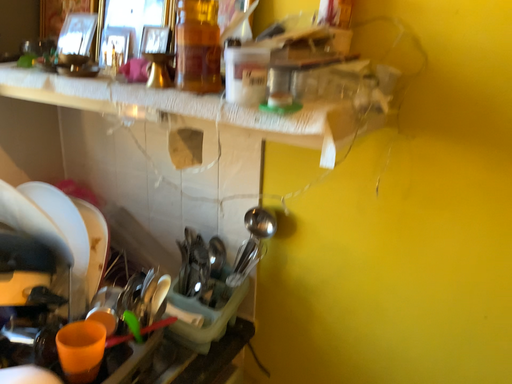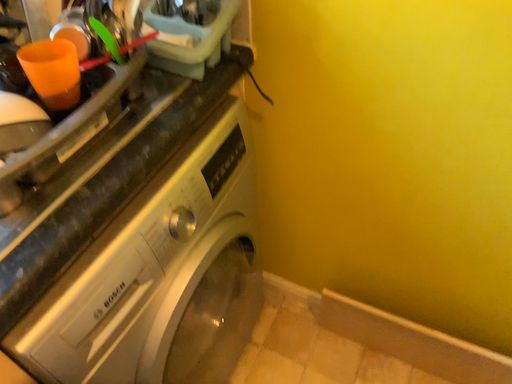
Question: How did the camera likely rotate when shooting the video?

Choices:
 (A) rotated downward
 (B) rotated upward

Answer: (A)